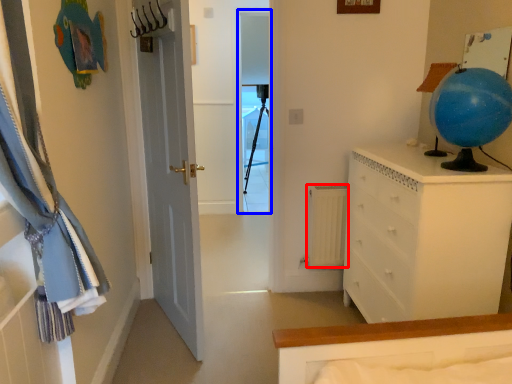
Question: Among these objects, which one is nearest to the camera, radiator (highlighted by a red box) or screen door (highlighted by a blue box)?

Choices:
 (A) radiator
 (B) screen door

Answer: (A)